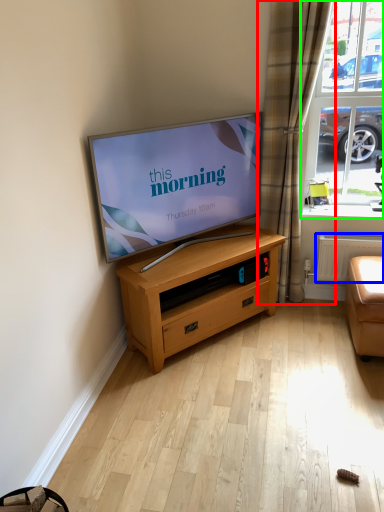
Question: Considering the real-world distances, which object is closest to curtain (highlighted by a red box)? radiator (highlighted by a blue box) or window (highlighted by a green box).

Choices:
 (A) radiator
 (B) window

Answer: (B)